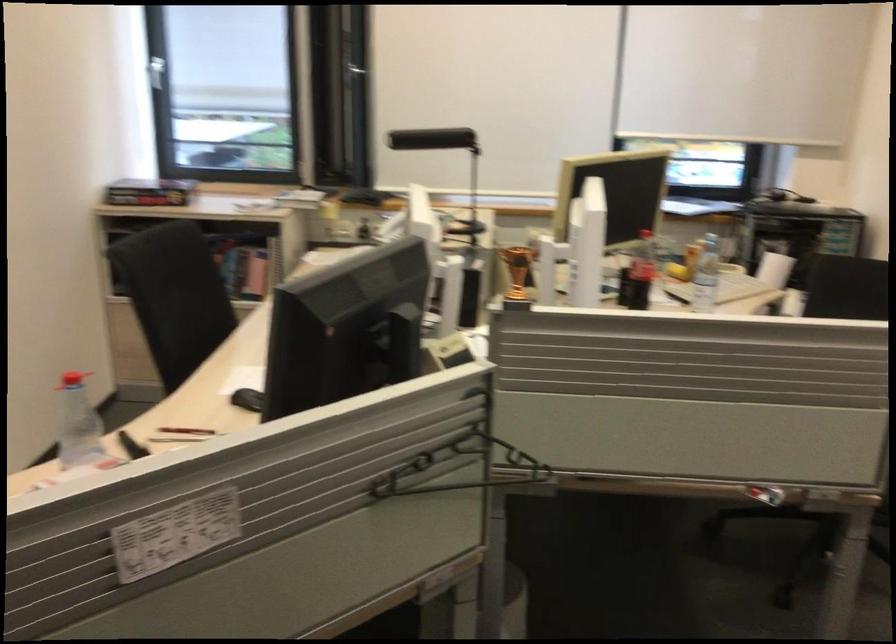
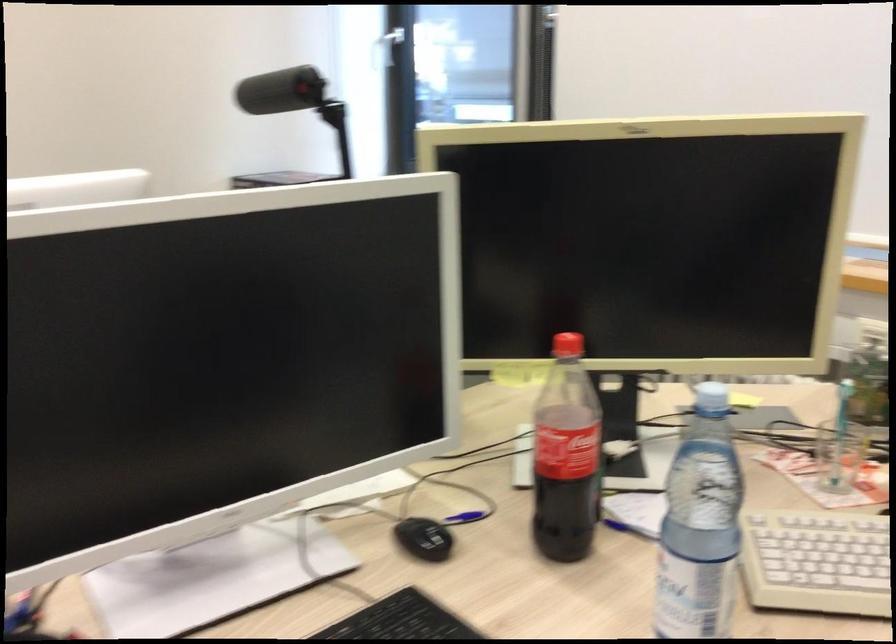
Find the pixel in the second image that matches point (640, 269) in the first image.

(565, 456)